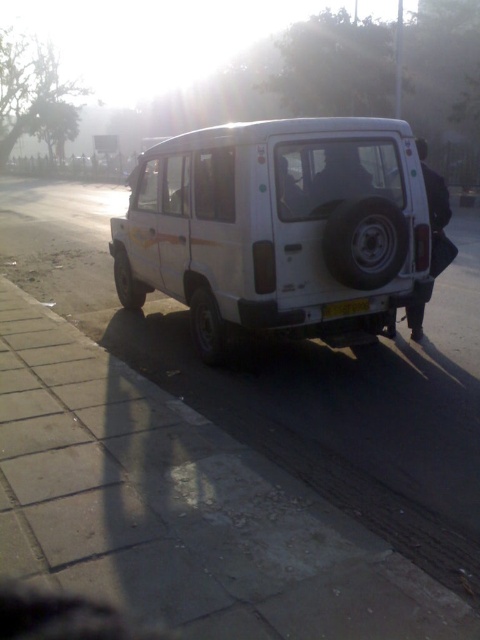
Describe the element at coordinates (294, 380) in the screenshot. I see `gray concrete pavement at center` at that location.

Find the location of a particular element. This screenshot has height=640, width=480. gray concrete pavement at center is located at coordinates (294, 380).

Between point (8, 269) and point (356, 298), which one is positioned behind?

Point (8, 269)

This screenshot has width=480, height=640. I want to click on gray concrete pavement at center, so click(294, 380).

Can you confirm if gray concrete pavement at center is smaller than white matte van at center?

Actually, gray concrete pavement at center might be larger than white matte van at center.

Is point (386, 468) positioned behind point (149, 276)?

That is False.

Which is in front, point (465, 486) or point (423, 216)?

Point (465, 486) is in front.

The height and width of the screenshot is (640, 480). I want to click on gray concrete pavement at center, so click(294, 380).

Which is more to the right, white matte van at center or yellow plastic license plate at rear?

Positioned to the right is white matte van at center.

Does white matte van at center have a greater width compared to yellow plastic license plate at rear?

Incorrect, white matte van at center's width does not surpass yellow plastic license plate at rear's.

Where is `white matte van at center`? white matte van at center is located at coordinates (277, 227).

Locate an element on the screen. white matte van at center is located at coordinates click(x=277, y=227).